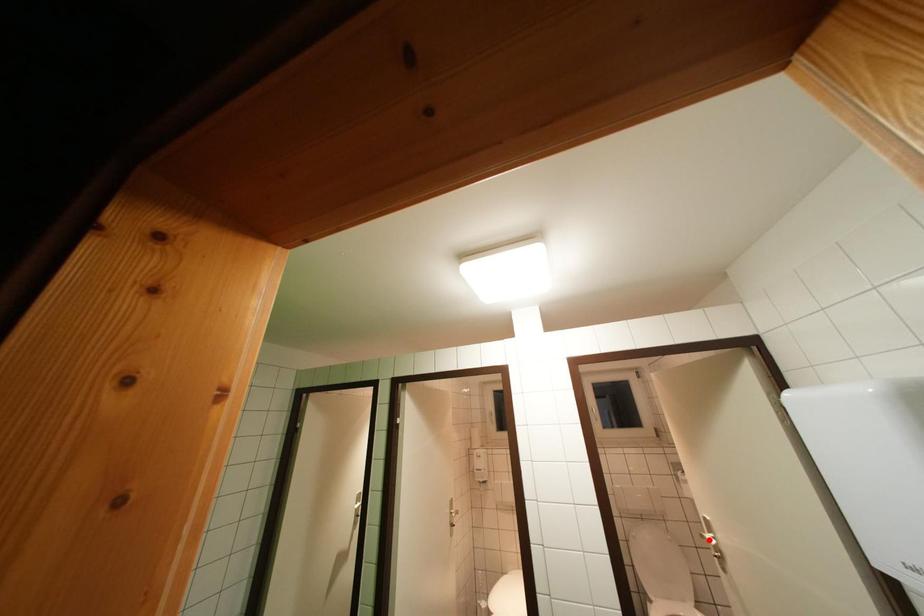
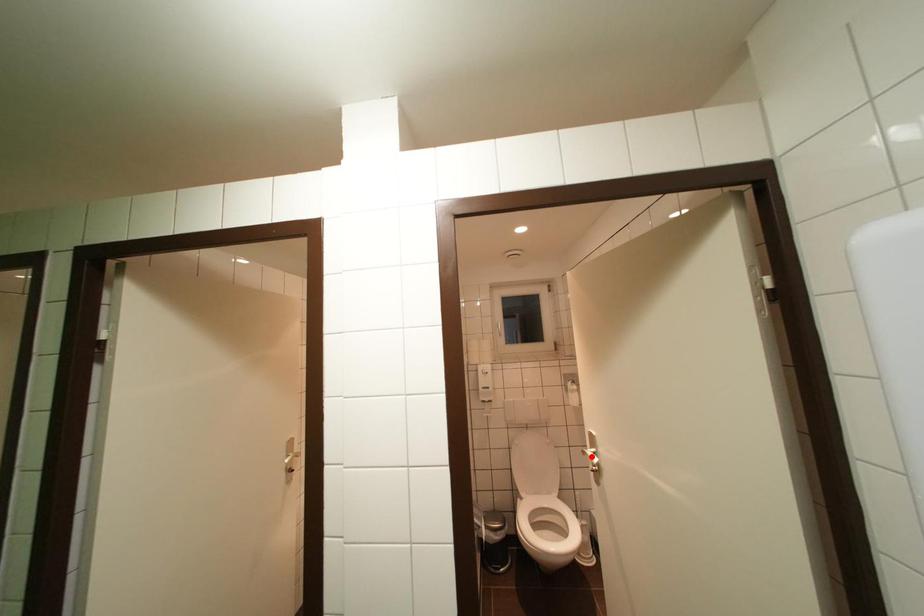
I am providing you with two images of the same scene from different viewpoints. A red point is marked on the first image and another point is marked on the second image. Is the marked point in image1 the same physical position as the marked point in image2?

Yes